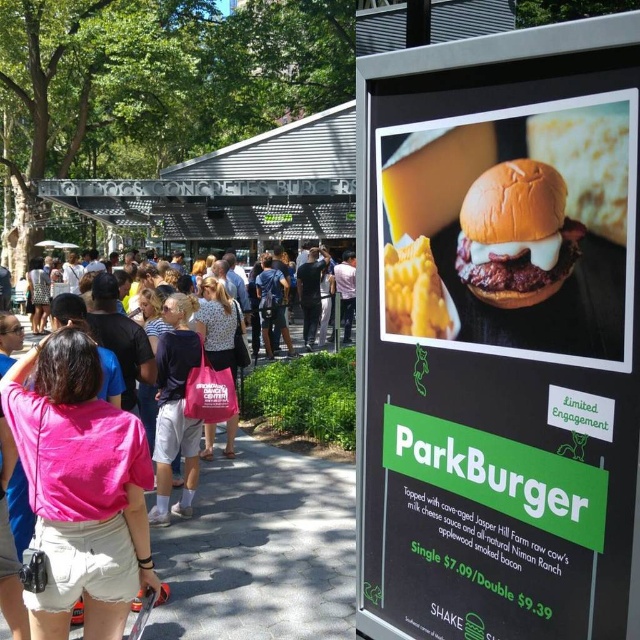
Question: Among these points, which one is nearest to the camera?

Choices:
 (A) (76, 516)
 (B) (625, 128)

Answer: (B)

Question: Does shiny black sign at upper right have a greater width compared to pink fabric bag at center?

Choices:
 (A) yes
 (B) no

Answer: (A)

Question: Can you confirm if shiny black sign at upper right is bigger than shiny golden cheeseburger at center?

Choices:
 (A) no
 (B) yes

Answer: (B)

Question: Does pink fabric crowd at center appear on the right side of golden brown bun at center?

Choices:
 (A) yes
 (B) no

Answer: (B)

Question: Which object appears closest to the camera in this image?

Choices:
 (A) shiny black sign at upper right
 (B) shiny golden cheeseburger at center
 (C) yellow corn at center
 (D) golden brown bun at center

Answer: (A)

Question: Which object appears farthest from the camera in this image?

Choices:
 (A) pink fabric bag at center
 (B) yellow corn at center

Answer: (A)